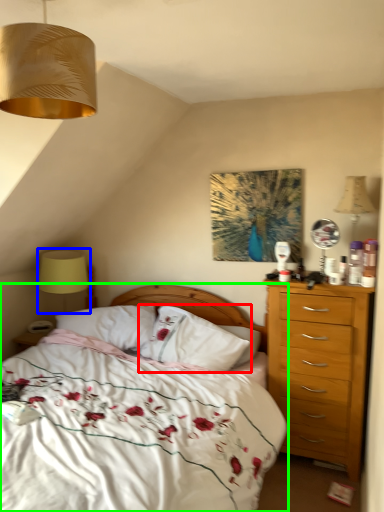
Question: Which is nearer to the pillow (highlighted by a red box)? table lamp (highlighted by a blue box) or bed (highlighted by a green box).

Choices:
 (A) table lamp
 (B) bed

Answer: (B)